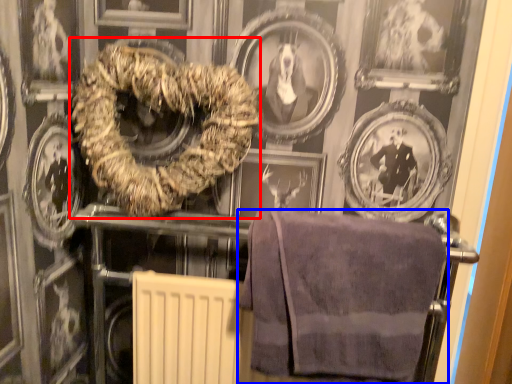
Question: Which object is further to the camera taking this photo, towel (highlighted by a red box) or towel (highlighted by a blue box)?

Choices:
 (A) towel
 (B) towel

Answer: (A)